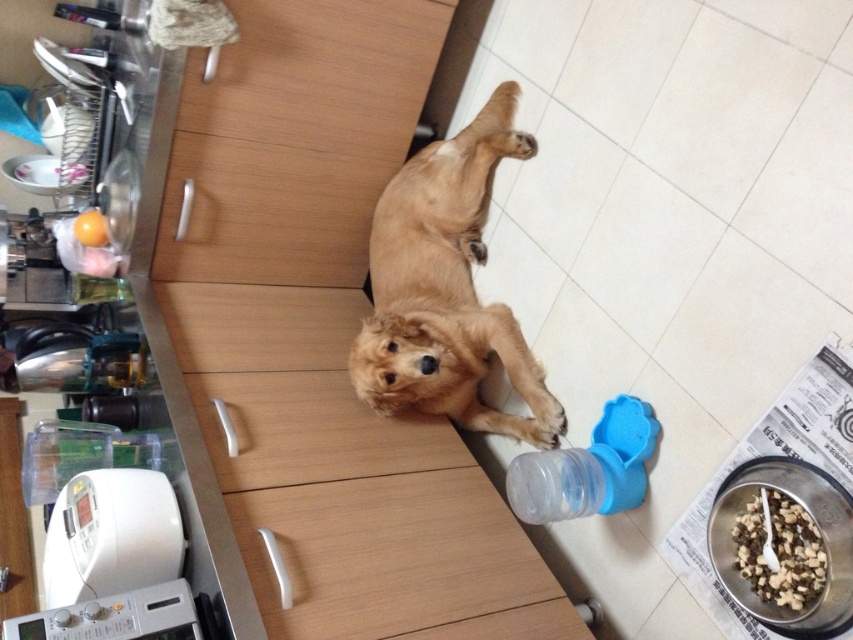
Question: Is golden fur dog at center thinner than translucent plastic bottle at lower center?

Choices:
 (A) no
 (B) yes

Answer: (A)

Question: Which point is farther to the camera?

Choices:
 (A) (630, 444)
 (B) (791, 509)
 (C) (409, 266)

Answer: (C)

Question: Among these points, which one is nearest to the camera?

Choices:
 (A) (810, 538)
 (B) (608, 502)

Answer: (A)

Question: Which point is closer to the camera taking this photo?

Choices:
 (A) (625, 449)
 (B) (457, 349)

Answer: (A)

Question: Observing the image, what is the correct spatial positioning of golden fur dog at center in reference to smooth brown kibble at lower right?

Choices:
 (A) left
 (B) right

Answer: (A)

Question: Is golden fur dog at center positioned in front of translucent plastic bottle at lower center?

Choices:
 (A) no
 (B) yes

Answer: (A)